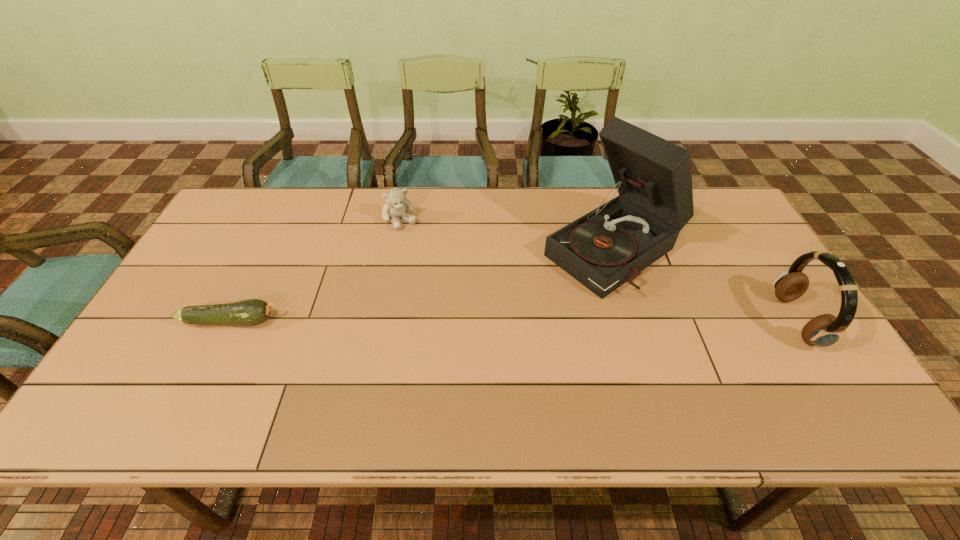
I want to click on the shortest object, so click(250, 312).

Where is `the leftmost object`? This screenshot has width=960, height=540. the leftmost object is located at coordinates (250, 312).

This screenshot has height=540, width=960. Find the location of `headset`. headset is located at coordinates (824, 330).

Find the location of `the rightmost object`. the rightmost object is located at coordinates (824, 330).

This screenshot has height=540, width=960. What are the coordinates of `phonograph_record` in the screenshot? It's located at (609, 246).

Locate an element on the screen. This screenshot has height=540, width=960. the second object from right to left is located at coordinates (609, 246).

Locate an element on the screen. teddy bear is located at coordinates (396, 206).

This screenshot has height=540, width=960. In order to click on the third tallest object in this screenshot , I will do `click(396, 206)`.

Where is `vacant area situated 0.170m at the blossom end of the leftmost object`? This screenshot has height=540, width=960. vacant area situated 0.170m at the blossom end of the leftmost object is located at coordinates (347, 321).

Find the location of a particular element. vacant space located 0.200m on the ear cup of the third shortest object is located at coordinates (705, 321).